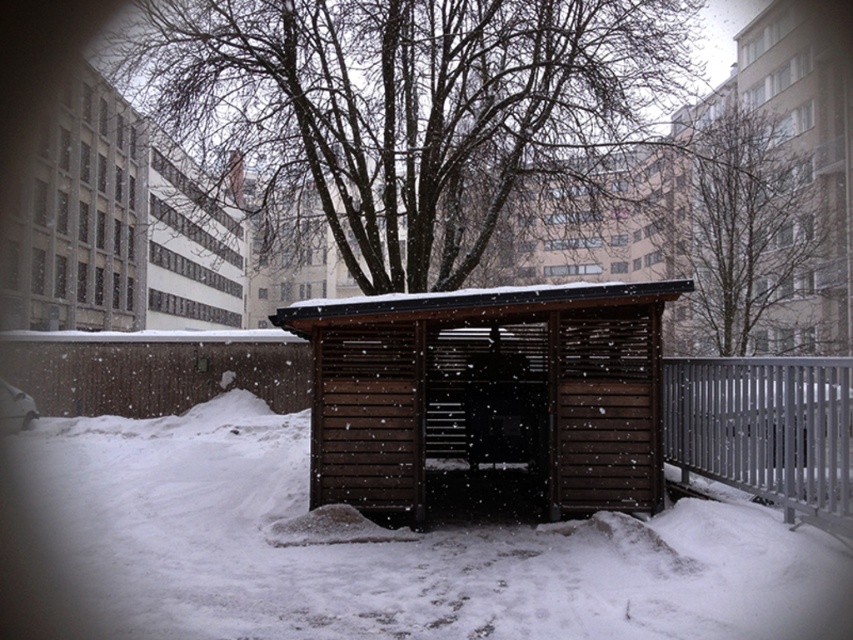
Does brown wooden bus stop at center have a lesser width compared to brown wooden hut at upper center?

Indeed, brown wooden bus stop at center has a lesser width compared to brown wooden hut at upper center.

Which is more to the left, brown wooden bus stop at center or brown wooden hut at upper center?

From the viewer's perspective, brown wooden hut at upper center appears more on the left side.

Does point (476, 353) lie in front of point (202, 300)?

That is True.

Locate an element on the screen. This screenshot has width=853, height=640. brown wooden bus stop at center is located at coordinates (486, 392).

Is white fluffy snow at center taller than brown wooden hut at left?

No, white fluffy snow at center is not taller than brown wooden hut at left.

Where is `white fluffy snow at center`? The image size is (853, 640). white fluffy snow at center is located at coordinates 368,550.

In order to click on white fluffy snow at center in this screenshot , I will do `click(368, 550)`.

This screenshot has width=853, height=640. In order to click on white fluffy snow at center in this screenshot , I will do `click(368, 550)`.

Consider the image. Does white fluffy snow at center have a larger size compared to bare branches at upper center?

Incorrect, white fluffy snow at center is not larger than bare branches at upper center.

Does white fluffy snow at center lie in front of bare branches at upper center?

Yes, white fluffy snow at center is closer to the viewer.

Describe the element at coordinates (368, 550) in the screenshot. I see `white fluffy snow at center` at that location.

Find the location of a particular element. The width and height of the screenshot is (853, 640). white fluffy snow at center is located at coordinates (368, 550).